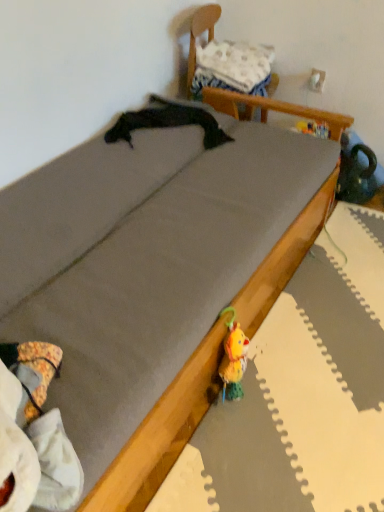
Question: Looking at their shapes, would you say white fabric pillow at upper center is wider or thinner than wooden chair at upper center?

Choices:
 (A) thin
 (B) wide

Answer: (A)

Question: Visually, is white fabric pillow at upper center positioned to the left or to the right of wooden chair at upper center?

Choices:
 (A) left
 (B) right

Answer: (A)

Question: Is point (233, 81) closer or farther from the camera than point (264, 121)?

Choices:
 (A) farther
 (B) closer

Answer: (A)

Question: Choose the correct answer: Is wooden chair at upper center inside white fabric pillow at upper center or outside it?

Choices:
 (A) outside
 (B) inside

Answer: (A)

Question: Is point click(261, 120) positioned closer to the camera than point click(218, 73)?

Choices:
 (A) closer
 (B) farther

Answer: (A)

Question: In terms of width, does wooden chair at upper center look wider or thinner when compared to white fabric pillow at upper center?

Choices:
 (A) wide
 (B) thin

Answer: (A)

Question: Based on their positions, is wooden chair at upper center located to the left or right of white fabric pillow at upper center?

Choices:
 (A) left
 (B) right

Answer: (B)